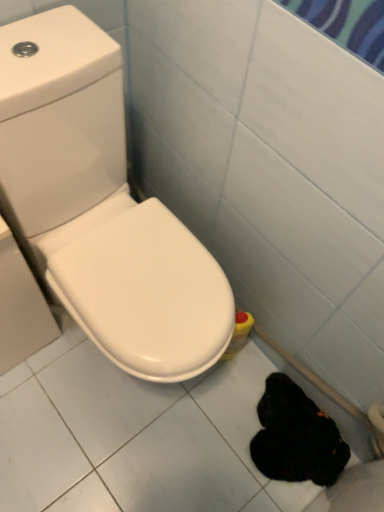
Question: Is white glossy toilet at center-left bigger or smaller than black fuzzy animal at lower right?

Choices:
 (A) big
 (B) small

Answer: (A)

Question: Considering the positions of point (77, 225) and point (269, 380), is point (77, 225) closer or farther from the camera than point (269, 380)?

Choices:
 (A) farther
 (B) closer

Answer: (B)

Question: Would you say white glossy toilet at center-left is to the left or to the right of black fuzzy animal at lower right in the picture?

Choices:
 (A) left
 (B) right

Answer: (A)

Question: Is black fuzzy animal at lower right inside or outside of white glossy toilet at center-left?

Choices:
 (A) inside
 (B) outside

Answer: (B)

Question: From the image's perspective, is black fuzzy animal at lower right positioned above or below white glossy toilet at center-left?

Choices:
 (A) below
 (B) above

Answer: (A)

Question: Is black fuzzy animal at lower right bigger or smaller than white glossy toilet at center-left?

Choices:
 (A) big
 (B) small

Answer: (B)

Question: Looking at their shapes, would you say black fuzzy animal at lower right is wider or thinner than white glossy toilet at center-left?

Choices:
 (A) thin
 (B) wide

Answer: (A)